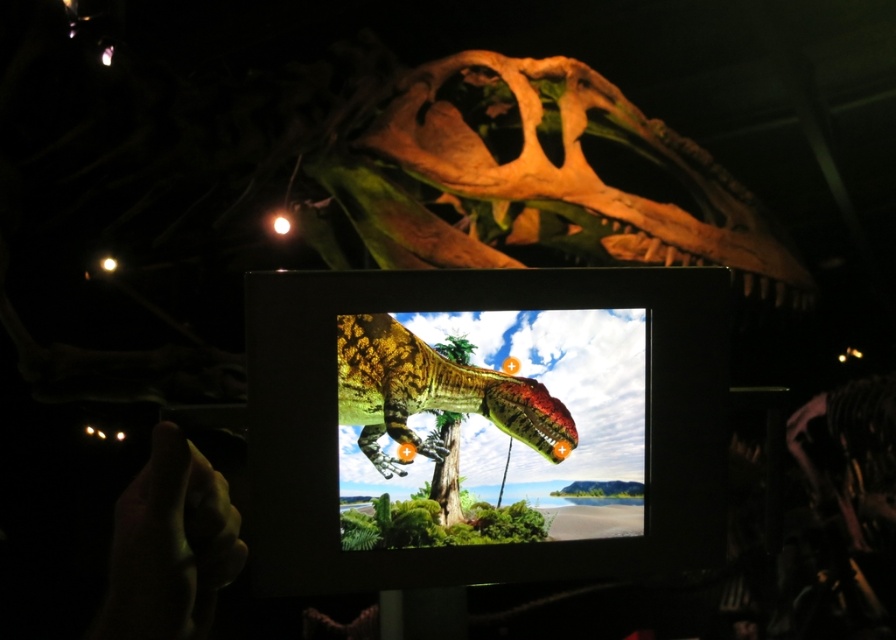
Question: Among these points, which one is farthest from the camera?

Choices:
 (A) click(x=366, y=422)
 (B) click(x=560, y=84)

Answer: (B)

Question: Which point is farther to the camera?

Choices:
 (A) shiny green dinosaur at center
 (B) shiny plastic screen at center
 (C) smooth skin hand at lower left
 (D) brown bone skull at upper center

Answer: (D)

Question: Does smooth skin hand at lower left lie in front of shiny green dinosaur at center?

Choices:
 (A) no
 (B) yes

Answer: (B)

Question: Which of these objects is positioned closest to the brown bone skull at upper center?

Choices:
 (A) shiny plastic screen at center
 (B) smooth skin hand at lower left
 (C) shiny green dinosaur at center

Answer: (A)

Question: Is smooth skin hand at lower left thinner than shiny green dinosaur at center?

Choices:
 (A) yes
 (B) no

Answer: (A)

Question: Does smooth skin hand at lower left lie in front of shiny green dinosaur at center?

Choices:
 (A) yes
 (B) no

Answer: (A)